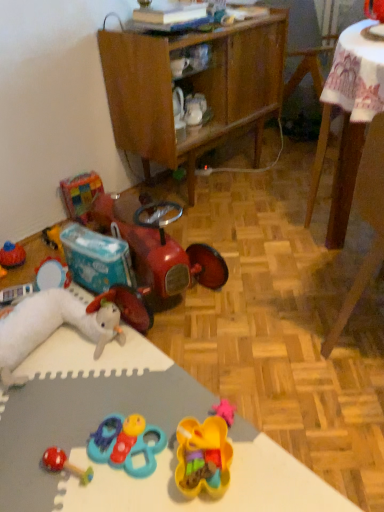
Where is `vacant space behind teal plastic toy at center, positioned as the 3th toy in right-to-left order`? This screenshot has height=512, width=384. vacant space behind teal plastic toy at center, positioned as the 3th toy in right-to-left order is located at coordinates (137, 388).